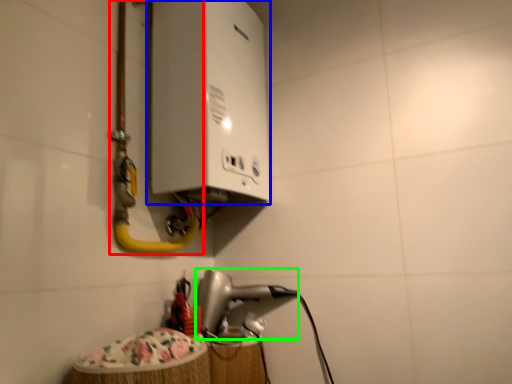
Question: Which is nearer to the water pipe (highlighted by a red box)? appliance (highlighted by a blue box) or appliance (highlighted by a green box).

Choices:
 (A) appliance
 (B) appliance

Answer: (A)